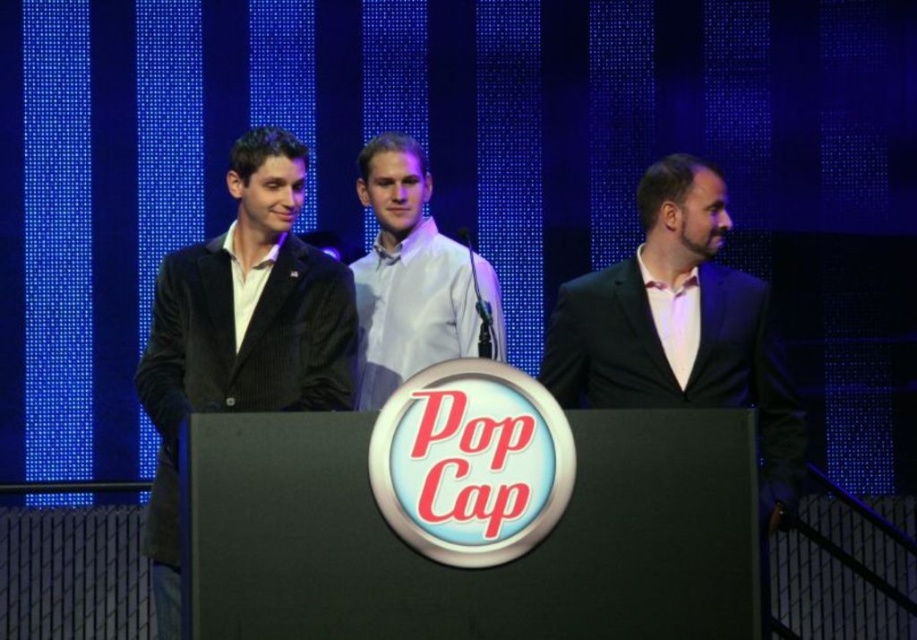
Question: Does velvet black suit at left appear on the left side of white glossy shirt at center?

Choices:
 (A) yes
 (B) no

Answer: (A)

Question: Which of the following is the farthest from the observer?

Choices:
 (A) (579, 292)
 (B) (433, 250)
 (C) (181, 339)

Answer: (B)

Question: Which is nearer to the velvet black suit at left?

Choices:
 (A) white glossy shirt at center
 (B) matte black suit at right

Answer: (A)

Question: Based on their relative distances, which object is nearer to the white glossy shirt at center?

Choices:
 (A) matte black suit at right
 (B) velvet black suit at left

Answer: (B)

Question: Can you confirm if velvet black suit at left is positioned below matte black suit at right?

Choices:
 (A) no
 (B) yes

Answer: (B)

Question: Is the position of velvet black suit at left less distant than that of white glossy shirt at center?

Choices:
 (A) yes
 (B) no

Answer: (A)